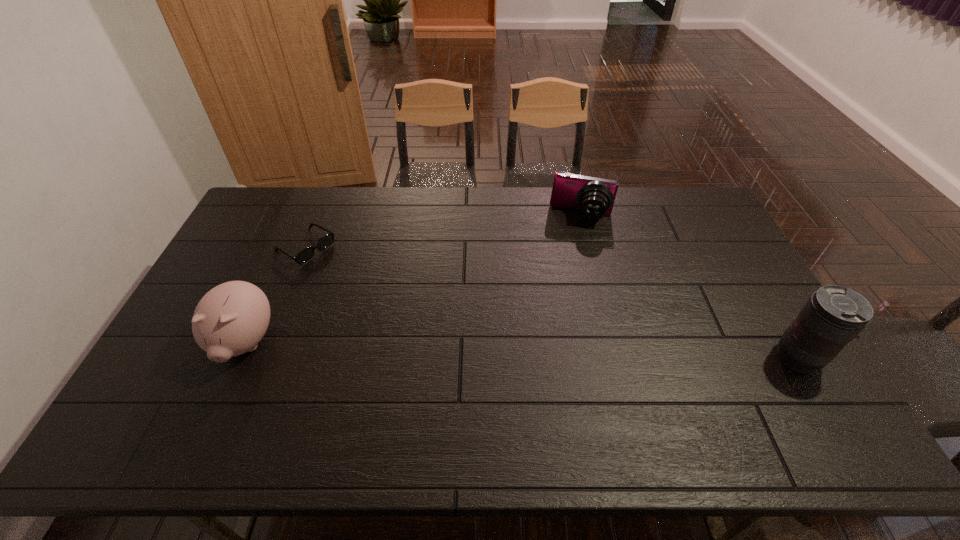
Where is `vacant space on the desktop that is between the second tallest object and the tallest object and is positioned on the front-facing side of the shortest object`? This screenshot has height=540, width=960. vacant space on the desktop that is between the second tallest object and the tallest object and is positioned on the front-facing side of the shortest object is located at coordinates (470, 349).

At what (x,y) coordinates should I click in order to perform the action: click on free space on the desktop that is between the piggy bank and the telephoto lens and is positioned on the front-facing side of the camera. Please return your answer as a coordinate pair (x, y). The height and width of the screenshot is (540, 960). Looking at the image, I should click on (557, 351).